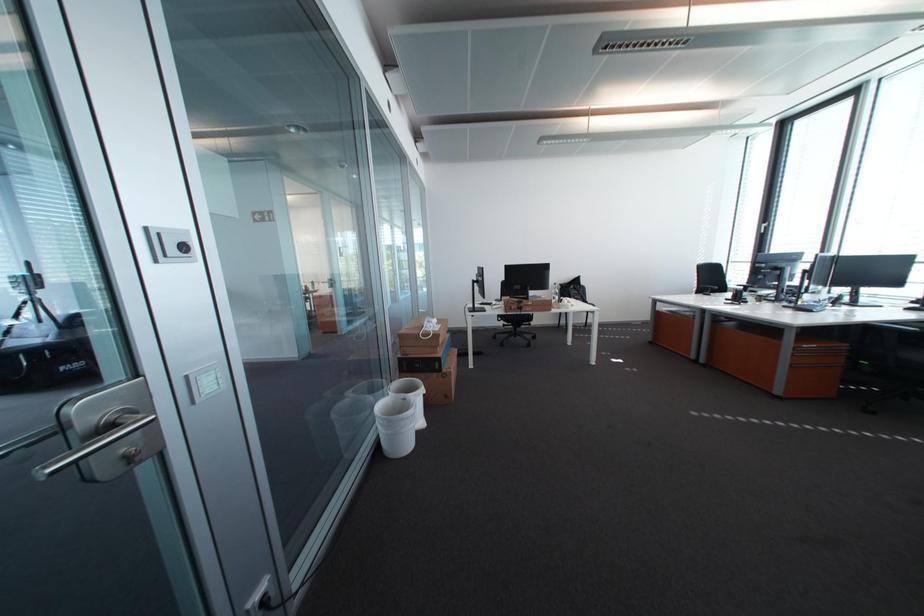
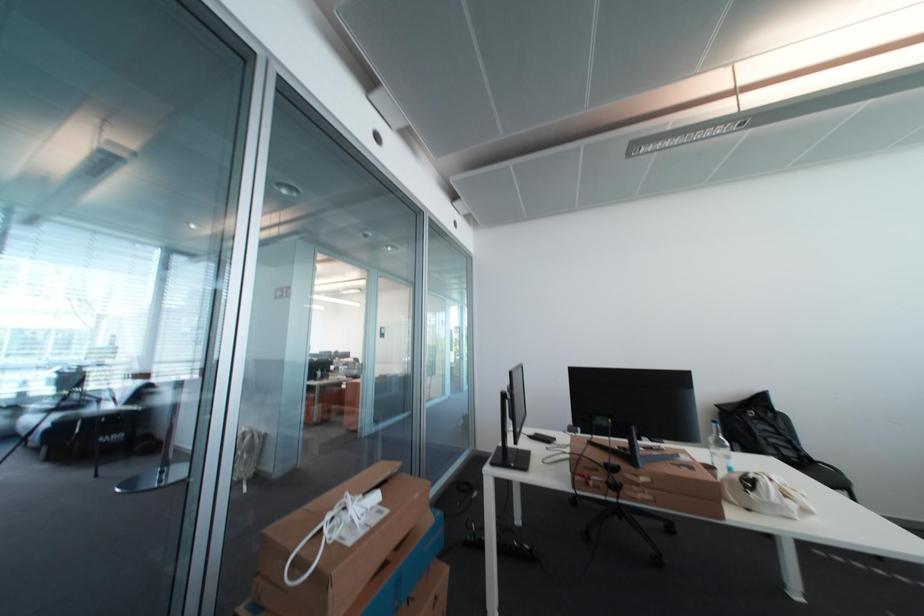
Question: In a continuous first-person perspective shot, in which direction is the camera moving?

Choices:
 (A) Left
 (B) Right
 (C) Forward
 (D) Backward

Answer: (C)